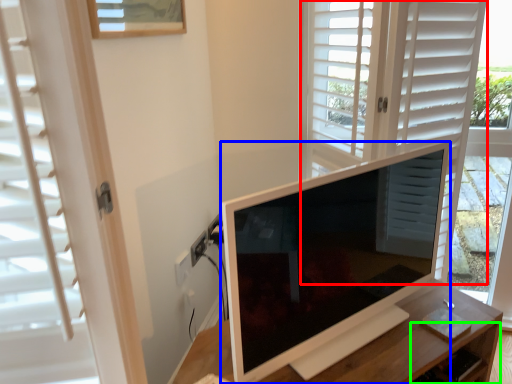
Question: Which is farther away from screen door (highlighted by a red box)? television (highlighted by a blue box) or drawer (highlighted by a green box)?

Choices:
 (A) television
 (B) drawer

Answer: (B)